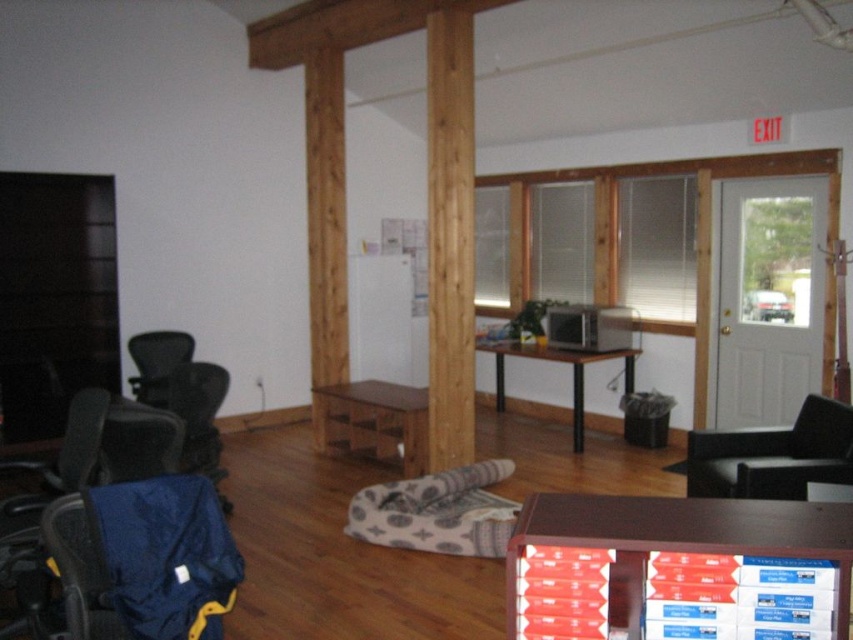
Question: Which object appears farthest from the camera in this image?

Choices:
 (A) wooden desk at center
 (B) brown wood table at center
 (C) blue fabric chair at lower left

Answer: (A)

Question: Is black leather swivel chair at lower right positioned in front of wooden desk at center?

Choices:
 (A) yes
 (B) no

Answer: (A)

Question: Which object is closer to the camera taking this photo?

Choices:
 (A) natural wood pillar at center
 (B) black leather swivel chair at lower right
 (C) wooden desk at center

Answer: (B)

Question: Does natural wood pillar at center have a greater width compared to wooden desk at center?

Choices:
 (A) yes
 (B) no

Answer: (B)

Question: Is black leather swivel chair at lower right positioned in front of matte black office chair at left?

Choices:
 (A) yes
 (B) no

Answer: (A)

Question: Which point is farther to the camera?

Choices:
 (A) natural wood pillar at center
 (B) wooden desk at center
 (C) brown wood table at center

Answer: (B)